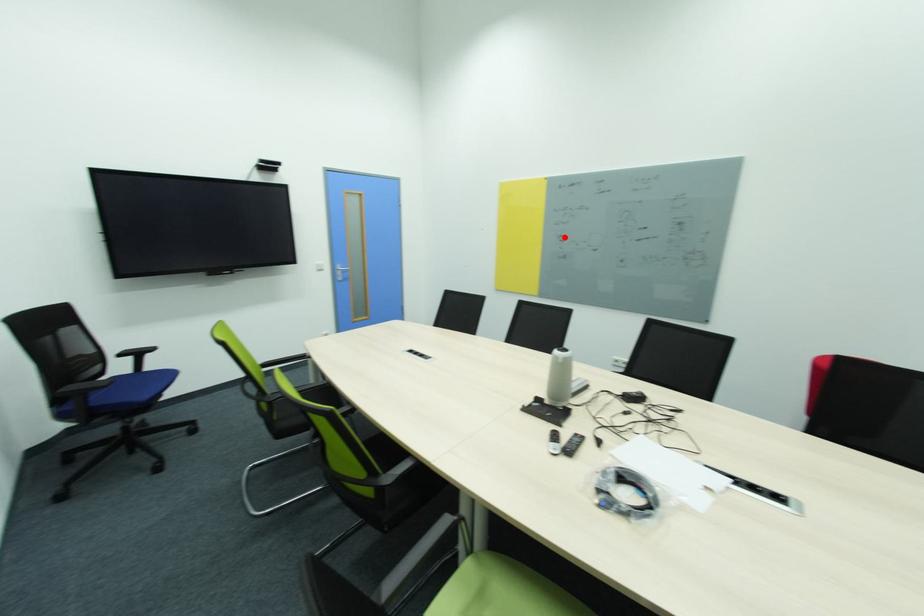
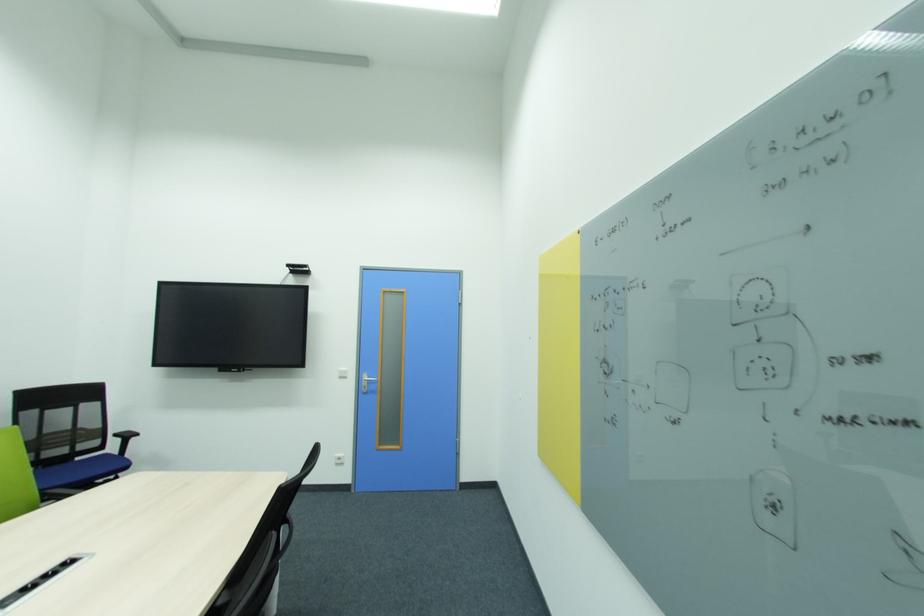
The point at the highlighted location is marked in the first image. Where is the corresponding point in the second image?

(610, 362)